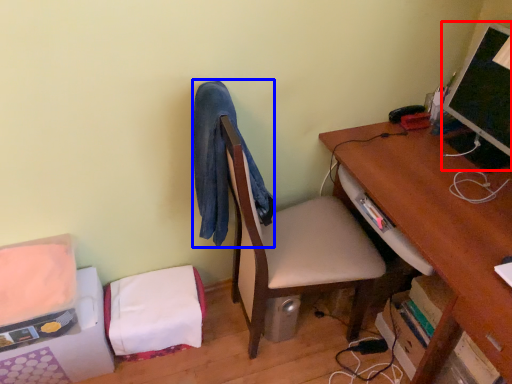
Question: Which of the following is the farthest to the observer, computer monitor (highlighted by a red box) or robe (highlighted by a blue box)?

Choices:
 (A) computer monitor
 (B) robe

Answer: (A)